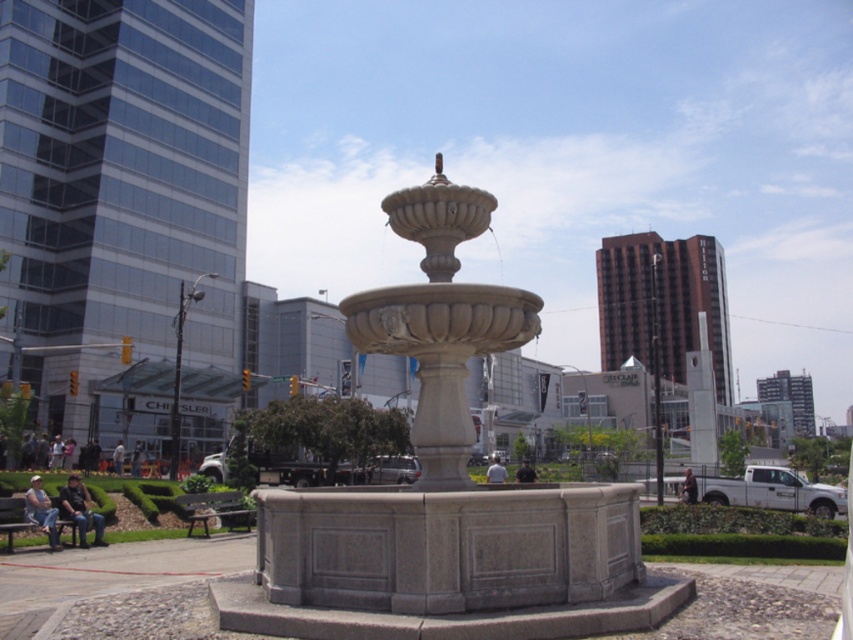
Question: Which point appears farthest from the camera in this image?

Choices:
 (A) (4, 515)
 (B) (206, 492)

Answer: (B)

Question: Which object is farther from the camera taking this photo?

Choices:
 (A) green wooden bench at lower left
 (B) gray stone fountain at center

Answer: (A)

Question: Which object is farther from the camera taking this photo?

Choices:
 (A) gray stone fountain at center
 (B) wooden park bench at lower left
 (C) green wooden bench at lower left

Answer: (B)

Question: Where is wooden park bench at lower left located in relation to green wooden bench at lower left in the image?

Choices:
 (A) below
 (B) above

Answer: (A)

Question: Is wooden park bench at lower left behind green wooden bench at lower left?

Choices:
 (A) yes
 (B) no

Answer: (A)

Question: Is the position of gray stone fountain at center more distant than that of wooden park bench at lower left?

Choices:
 (A) no
 (B) yes

Answer: (A)